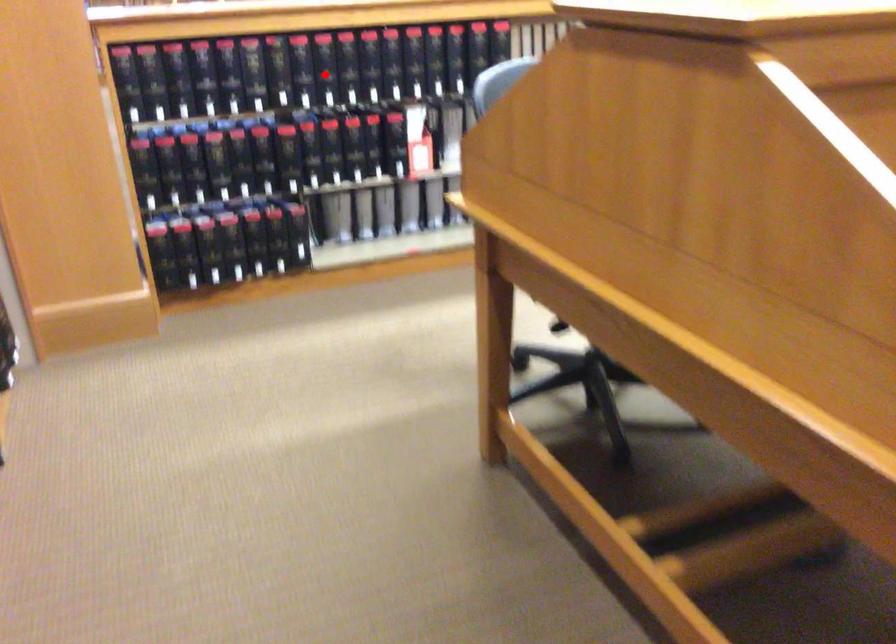
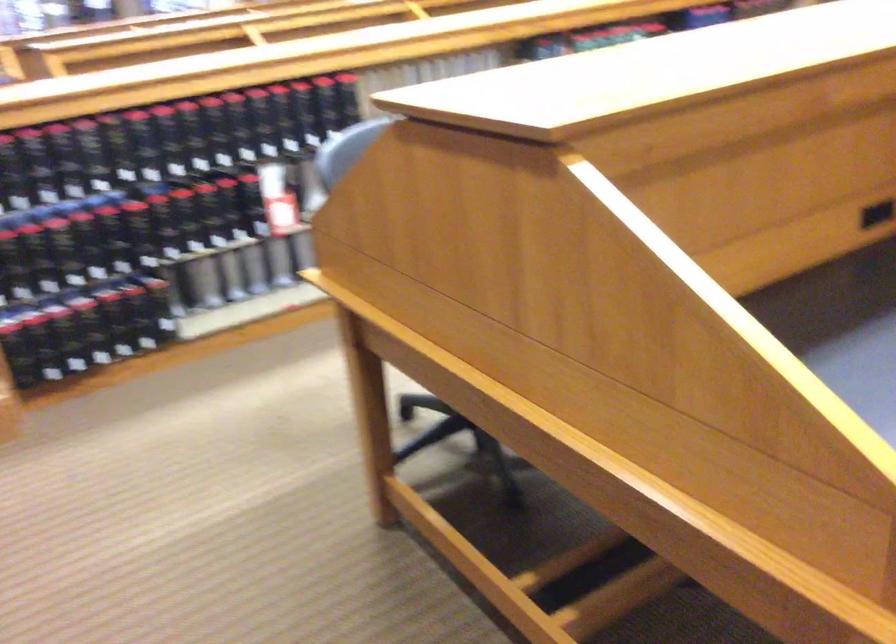
Locate, in the second image, the point that corresponds to the highlighted location in the first image.

(165, 142)